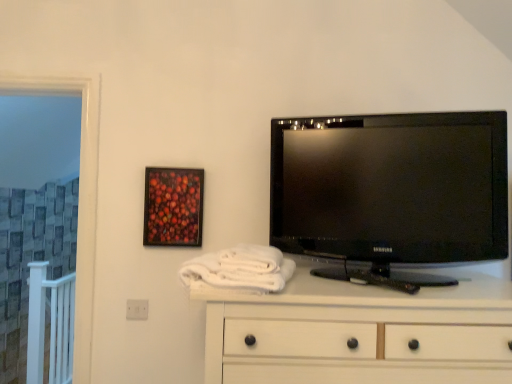
Question: From a real-world perspective, is wooden-framed artwork at upper left below white soft towel at center?

Choices:
 (A) yes
 (B) no

Answer: (B)

Question: Can you confirm if wooden-framed artwork at upper left is taller than white soft towel at center?

Choices:
 (A) no
 (B) yes

Answer: (B)

Question: Could you tell me if wooden-framed artwork at upper left is facing white soft towel at center?

Choices:
 (A) no
 (B) yes

Answer: (B)

Question: Is wooden-framed artwork at upper left oriented away from white soft towel at center?

Choices:
 (A) yes
 (B) no

Answer: (B)

Question: Would you consider wooden-framed artwork at upper left to be distant from white soft towel at center?

Choices:
 (A) no
 (B) yes

Answer: (A)

Question: Is wooden-framed artwork at upper left beside white soft towel at center?

Choices:
 (A) yes
 (B) no

Answer: (B)

Question: Does white soft towel at center come behind wooden-framed artwork at upper left?

Choices:
 (A) no
 (B) yes

Answer: (A)

Question: Considering the relative sizes of white soft towel at center and wooden-framed artwork at upper left in the image provided, is white soft towel at center thinner than wooden-framed artwork at upper left?

Choices:
 (A) yes
 (B) no

Answer: (B)

Question: Would you say wooden-framed artwork at upper left is part of white soft towel at center's contents?

Choices:
 (A) yes
 (B) no

Answer: (B)

Question: Is white soft towel at center oriented away from wooden-framed artwork at upper left?

Choices:
 (A) no
 (B) yes

Answer: (A)

Question: From the image's perspective, does white soft towel at center appear lower than wooden-framed artwork at upper left?

Choices:
 (A) no
 (B) yes

Answer: (B)

Question: Does white soft towel at center have a smaller size compared to wooden-framed artwork at upper left?

Choices:
 (A) yes
 (B) no

Answer: (B)

Question: Does white soft towel at center lie behind black glossy tv at upper right?

Choices:
 (A) no
 (B) yes

Answer: (A)